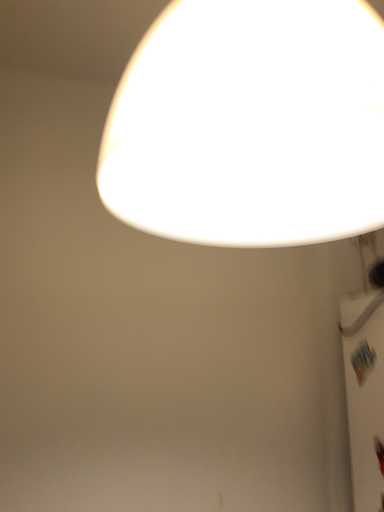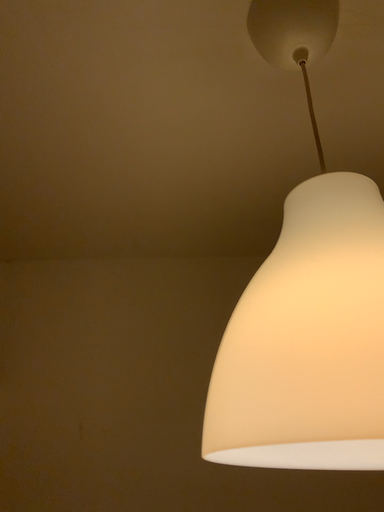
Question: Which way did the camera rotate in the video?

Choices:
 (A) rotated upward
 (B) rotated downward

Answer: (A)